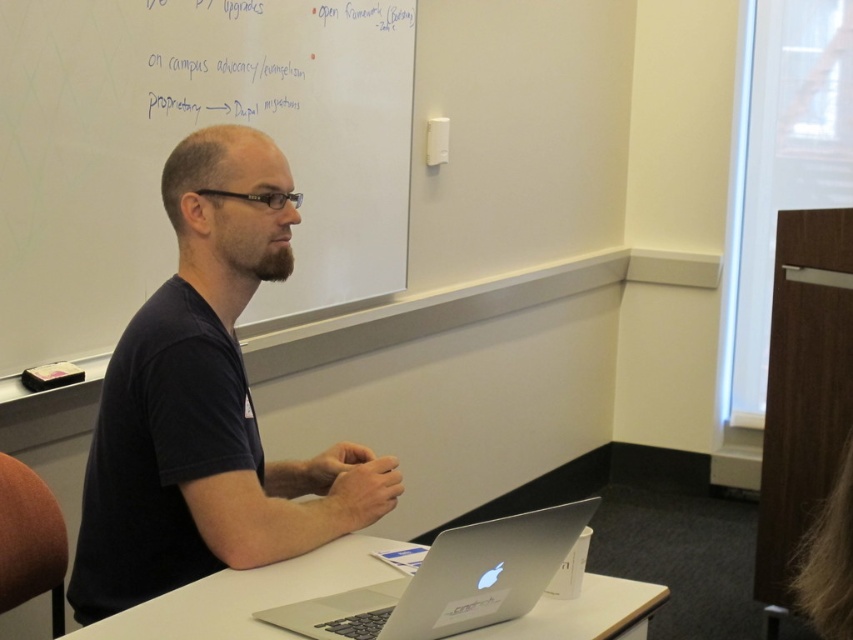
In the scene shown: You are organizing a presentation and need to place a name tag on the table. The name tag must be placed between the black matte shirt at center and the sleek silver laptop at center. Where should you position the name tag?

The name tag should be placed between the black matte shirt at center and the sleek silver laptop at center, positioned to the right of the black matte shirt at center and to the left of the sleek silver laptop at center since the black matte shirt at center is on the left side of the sleek silver laptop at center.

You are standing in a classroom and want to write a note on the white matte whiteboard at upper left while also keeping an eye on the black matte shirt at center. Which object is closer to your left side?

The white matte whiteboard at upper left is to the left of the black matte shirt at center, so it is closer to your left side.